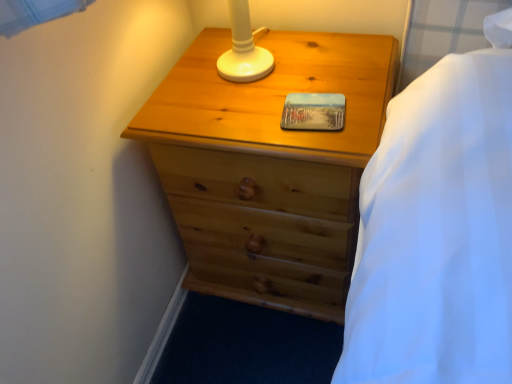
Question: Is metallic photo frame at center inside the boundaries of natural wood chest of drawers at center, or outside?

Choices:
 (A) inside
 (B) outside

Answer: (A)

Question: Is metallic photo frame at center to the left or to the right of natural wood chest of drawers at center in the image?

Choices:
 (A) left
 (B) right

Answer: (B)

Question: Is metallic photo frame at center in front of or behind natural wood chest of drawers at center in the image?

Choices:
 (A) behind
 (B) front

Answer: (A)

Question: From a real-world perspective, is natural wood chest of drawers at center above or below metallic photo frame at center?

Choices:
 (A) below
 (B) above

Answer: (A)

Question: Is natural wood chest of drawers at center to the left or to the right of metallic photo frame at center in the image?

Choices:
 (A) right
 (B) left

Answer: (B)

Question: Considering the positions of natural wood chest of drawers at center and metallic photo frame at center in the image, is natural wood chest of drawers at center wider or thinner than metallic photo frame at center?

Choices:
 (A) thin
 (B) wide

Answer: (B)

Question: Considering their positions, is natural wood chest of drawers at center located in front of or behind metallic photo frame at center?

Choices:
 (A) front
 (B) behind

Answer: (A)